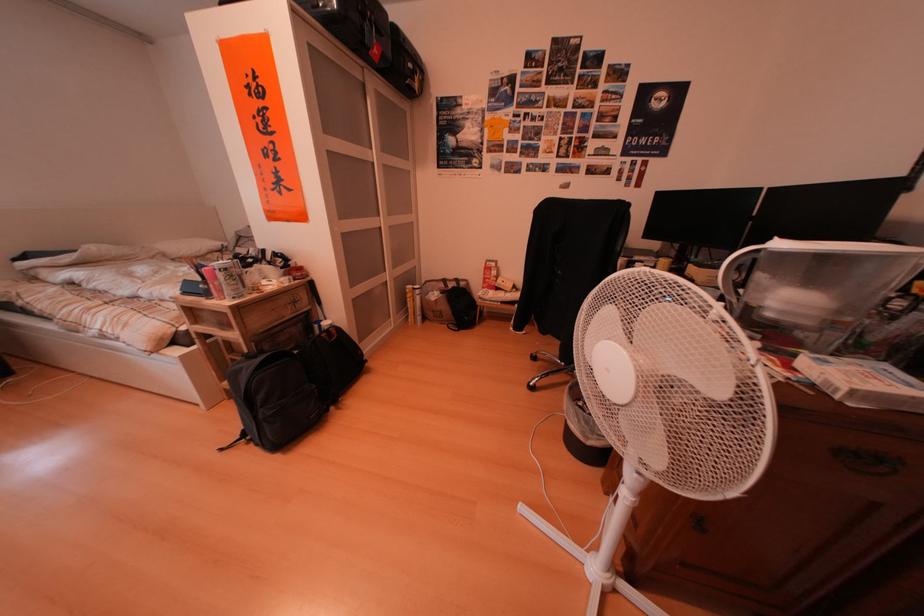
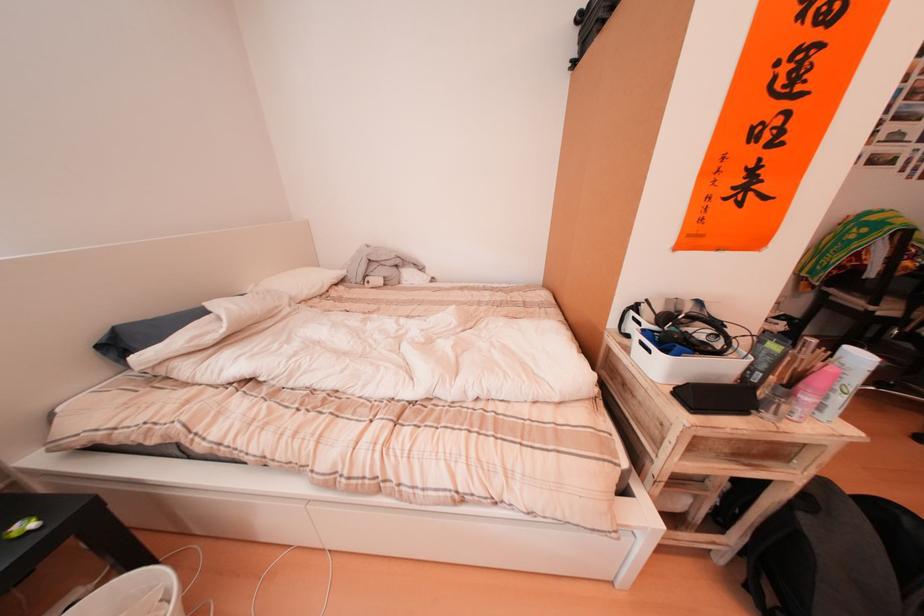
Where in the second image is the point corresponding to point (258, 245) from the first image?

(390, 270)